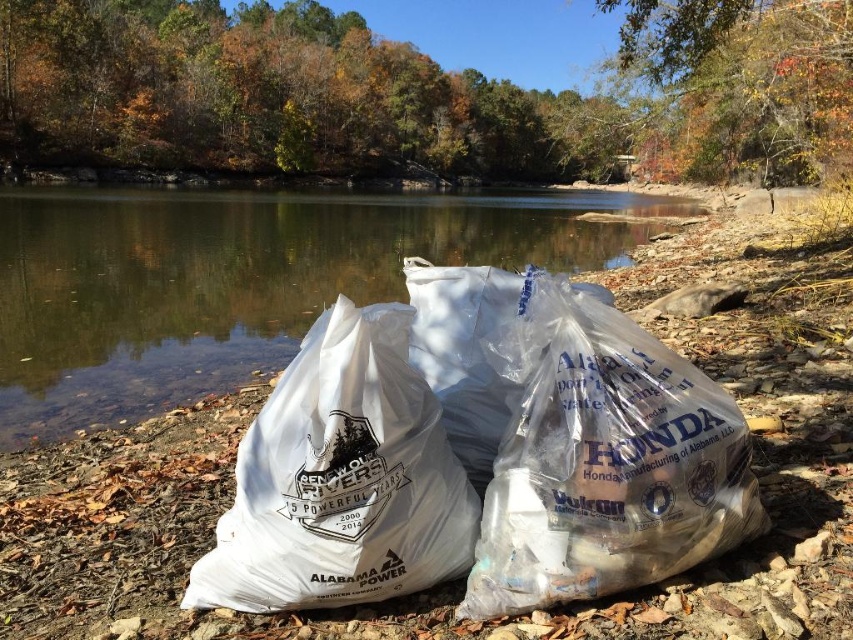
Question: Where is white plastic bags at center located in relation to transparent plastic bags at center in the image?

Choices:
 (A) right
 (B) left

Answer: (A)

Question: Which point is closer to the camera taking this photo?

Choices:
 (A) (329, 580)
 (B) (134, 275)

Answer: (A)

Question: Considering the real-world distances, which object is farthest from the white plastic bag at center?

Choices:
 (A) white plastic bags at center
 (B) transparent plastic bags at center

Answer: (B)

Question: Can you confirm if white plastic bags at center is bigger than transparent plastic bags at center?

Choices:
 (A) yes
 (B) no

Answer: (B)

Question: Considering the relative positions of white plastic bags at center and transparent plastic bags at center in the image provided, where is white plastic bags at center located with respect to transparent plastic bags at center?

Choices:
 (A) above
 (B) below

Answer: (B)

Question: Which of the following is the closest to the observer?

Choices:
 (A) pos(323,538)
 (B) pos(9,355)
 (C) pos(390,406)

Answer: (A)